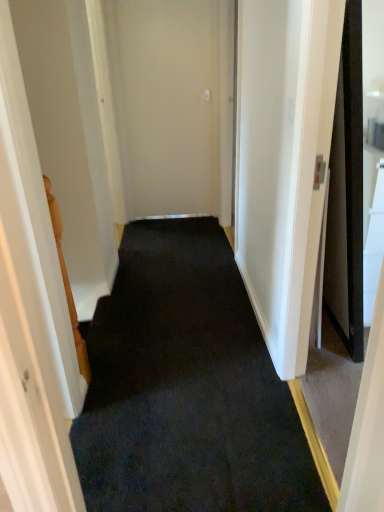
Question: Is black carpet at center wider or thinner than beige matte door at center?

Choices:
 (A) thin
 (B) wide

Answer: (B)

Question: Considering the positions of point (248, 402) and point (211, 188), is point (248, 402) closer or farther from the camera than point (211, 188)?

Choices:
 (A) farther
 (B) closer

Answer: (B)

Question: Considering their positions, is black carpet at center located in front of or behind beige matte door at center?

Choices:
 (A) front
 (B) behind

Answer: (A)

Question: Is beige matte door at center wider or thinner than black carpet at center?

Choices:
 (A) wide
 (B) thin

Answer: (B)

Question: Is beige matte door at center in front of or behind black carpet at center in the image?

Choices:
 (A) front
 (B) behind

Answer: (B)

Question: From the image's perspective, is beige matte door at center located above or below black carpet at center?

Choices:
 (A) below
 (B) above

Answer: (B)

Question: From a real-world perspective, is beige matte door at center above or below black carpet at center?

Choices:
 (A) below
 (B) above

Answer: (B)